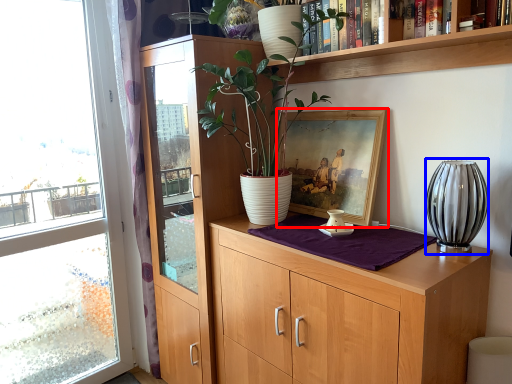
Question: Which object is closer to the camera taking this photo, picture frame (highlighted by a red box) or vase (highlighted by a blue box)?

Choices:
 (A) picture frame
 (B) vase

Answer: (B)